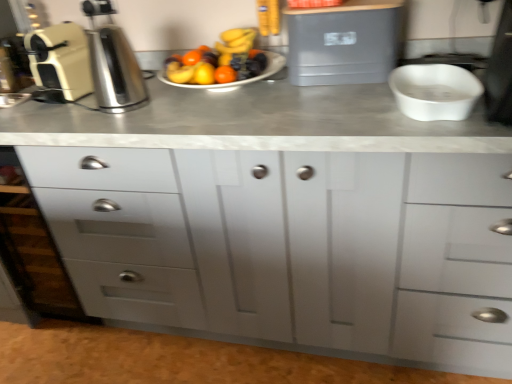
Where is `white matte chest of drawers at center`? white matte chest of drawers at center is located at coordinates (x=292, y=246).

Describe the element at coordinates (292, 246) in the screenshot. I see `white matte chest of drawers at center` at that location.

At what (x,y) coordinates should I click in order to perform the action: click on cream matte coffee machine at left, the 2th appliance in the right-to-left sequence. Please return your answer as a coordinate pair (x, y). Image resolution: width=512 pixels, height=384 pixels. Looking at the image, I should click on (59, 63).

The height and width of the screenshot is (384, 512). What do you see at coordinates (59, 63) in the screenshot?
I see `cream matte coffee machine at left, the 2th appliance in the right-to-left sequence` at bounding box center [59, 63].

This screenshot has height=384, width=512. In order to click on white glossy mixing bowl at right in this screenshot , I will do `click(435, 91)`.

Does point (372, 77) lie in front of point (102, 80)?

No, (372, 77) is further to viewer.

Choose the correct answer: Is gray plastic container at upper center, the second appliance in the left-to-right sequence, inside satin silver coffee machine at left or outside it?

gray plastic container at upper center, the second appliance in the left-to-right sequence, is outside satin silver coffee machine at left.

Is gray plastic container at upper center, the 1th appliance positioned from the right, to the right of satin silver coffee machine at left from the viewer's perspective?

Yes, gray plastic container at upper center, the 1th appliance positioned from the right, is to the right of satin silver coffee machine at left.

From the image's perspective, is gray plastic container at upper center, the 1th appliance positioned from the right, located above satin silver coffee machine at left?

Yes, from the image's perspective, gray plastic container at upper center, the 1th appliance positioned from the right, is on top of satin silver coffee machine at left.

Which of these two, white matte drawer at left or gray plastic container at upper center, the 1th appliance positioned from the right, stands shorter?

gray plastic container at upper center, the 1th appliance positioned from the right, is shorter.

This screenshot has width=512, height=384. Identify the location of the 2nd appliance in front when counting from the white matte drawer at left. (345, 42).

Based on the photo, from the image's perspective, is white matte drawer at left above or below gray plastic container at upper center, the 1th appliance positioned from the right?

From the image's perspective, white matte drawer at left appears below gray plastic container at upper center, the 1th appliance positioned from the right.

Considering their positions, is white matte drawer at left located in front of or behind gray plastic container at upper center, the 1th appliance positioned from the right?

white matte drawer at left is positioned farther from the viewer than gray plastic container at upper center, the 1th appliance positioned from the right.

Is cream matte coffee machine at left, marked as the 1th appliance in a left-to-right arrangement, next to gray plastic container at upper center, the second appliance in the left-to-right sequence, and touching it?

No, cream matte coffee machine at left, marked as the 1th appliance in a left-to-right arrangement, is not next to gray plastic container at upper center, the second appliance in the left-to-right sequence.

Is cream matte coffee machine at left, the 2th appliance in the right-to-left sequence, bigger than gray plastic container at upper center, the second appliance in the left-to-right sequence?

Actually, cream matte coffee machine at left, the 2th appliance in the right-to-left sequence, might be smaller than gray plastic container at upper center, the second appliance in the left-to-right sequence.

Considering the sizes of objects cream matte coffee machine at left, the 2th appliance in the right-to-left sequence, and gray plastic container at upper center, the second appliance in the left-to-right sequence, in the image provided, who is wider, cream matte coffee machine at left, the 2th appliance in the right-to-left sequence, or gray plastic container at upper center, the second appliance in the left-to-right sequence,?

Wider between the two is cream matte coffee machine at left, the 2th appliance in the right-to-left sequence.

Consider the image. From a real-world perspective, between cream matte coffee machine at left, marked as the 1th appliance in a left-to-right arrangement, and gray plastic container at upper center, the second appliance in the left-to-right sequence, who is vertically lower?

gray plastic container at upper center, the second appliance in the left-to-right sequence, is physically lower.

Is point (402, 342) farther from camera compared to point (86, 264)?

No.

Is white matte chest of drawers at center turned away from white matte drawer at left?

That's not correct — white matte chest of drawers at center is not looking away from white matte drawer at left.

Between white matte chest of drawers at center and white matte drawer at left, which one has larger size?

white matte chest of drawers at center is bigger.

Is white matte chest of drawers at center further to camera compared to white matte drawer at left?

No, the depth of white matte chest of drawers at center is less than that of white matte drawer at left.

Looking at this image, does white matte chest of drawers at center have a larger size compared to gray plastic container at upper center, the second appliance in the left-to-right sequence?

Indeed, white matte chest of drawers at center has a larger size compared to gray plastic container at upper center, the second appliance in the left-to-right sequence.

Is white matte chest of drawers at center next to gray plastic container at upper center, the second appliance in the left-to-right sequence, and touching it?

No.

Who is shorter, white matte chest of drawers at center or gray plastic container at upper center, the second appliance in the left-to-right sequence?

With less height is gray plastic container at upper center, the second appliance in the left-to-right sequence.

Is white matte chest of drawers at center at the left side of gray plastic container at upper center, the second appliance in the left-to-right sequence?

Indeed, white matte chest of drawers at center is positioned on the left side of gray plastic container at upper center, the second appliance in the left-to-right sequence.

How many degrees apart are the facing directions of satin silver coffee machine at left and white matte drawer at left?

46 degrees separate the facing orientations of satin silver coffee machine at left and white matte drawer at left.

Considering the sizes of satin silver coffee machine at left and white matte drawer at left in the image, is satin silver coffee machine at left taller or shorter than white matte drawer at left?

satin silver coffee machine at left is shorter than white matte drawer at left.

Where is `drawer on the left of the satin silver coffee machine at left`? drawer on the left of the satin silver coffee machine at left is located at coordinates (119, 231).

Is satin silver coffee machine at left at the left side of white matte drawer at left?

No.

Which is behind, white glossy mixing bowl at right or gray plastic container at upper center, the second appliance in the left-to-right sequence?

gray plastic container at upper center, the second appliance in the left-to-right sequence, is more distant.

Considering the positions of objects white glossy mixing bowl at right and gray plastic container at upper center, the second appliance in the left-to-right sequence, in the image provided, who is more to the right, white glossy mixing bowl at right or gray plastic container at upper center, the second appliance in the left-to-right sequence,?

Positioned to the right is white glossy mixing bowl at right.

Which point is more distant from viewer, (425, 116) or (317, 43)?

The point (317, 43) is behind.

Choose the correct answer: Is white glossy mixing bowl at right inside gray plastic container at upper center, the second appliance in the left-to-right sequence, or outside it?

white glossy mixing bowl at right exists outside the volume of gray plastic container at upper center, the second appliance in the left-to-right sequence.

At what (x,y) coordinates should I click in order to perform the action: click on appliance beneath the satin silver coffee machine at left (from a real-world perspective). Please return your answer as a coordinate pair (x, y). The image size is (512, 384). Looking at the image, I should click on (345, 42).

Where is `drawer on the left of the gray plastic container at upper center, the 1th appliance positioned from the right`? The image size is (512, 384). drawer on the left of the gray plastic container at upper center, the 1th appliance positioned from the right is located at coordinates (119, 231).

When comparing their distances from satin silver coffee machine at left, does gray plastic container at upper center, the second appliance in the left-to-right sequence, or white glossy mixing bowl at right seem closer?

gray plastic container at upper center, the second appliance in the left-to-right sequence, lies closer to satin silver coffee machine at left than the other object.

From the picture: Based on their spatial positions, is gray plastic container at upper center, the 1th appliance positioned from the right, or white glossy mixing bowl at right further from white matte drawer at left?

The object further to white matte drawer at left is white glossy mixing bowl at right.

Considering their positions, is gray plastic container at upper center, the second appliance in the left-to-right sequence, positioned further to white glossy mixing bowl at right than white matte drawer at left?

Among the two, white matte drawer at left is located further to white glossy mixing bowl at right.

Looking at this image, considering their positions, is white matte drawer at left positioned closer to white matte chest of drawers at center than gray plastic container at upper center, the second appliance in the left-to-right sequence?

The object closer to white matte chest of drawers at center is white matte drawer at left.

Considering their positions, is cream matte coffee machine at left, marked as the 1th appliance in a left-to-right arrangement, positioned closer to white matte drawer at left than satin silver coffee machine at left?

The object closer to white matte drawer at left is satin silver coffee machine at left.

Estimate the real-world distances between objects in this image. Which object is further from cream matte coffee machine at left, the 2th appliance in the right-to-left sequence, white matte chest of drawers at center or white matte drawer at left?

white matte chest of drawers at center.

From the image, which object appears to be farther from gray plastic container at upper center, the second appliance in the left-to-right sequence, cream matte coffee machine at left, marked as the 1th appliance in a left-to-right arrangement, or white glossy mixing bowl at right?

The object further to gray plastic container at upper center, the second appliance in the left-to-right sequence, is cream matte coffee machine at left, marked as the 1th appliance in a left-to-right arrangement.

When comparing their distances from white matte drawer at left, does cream matte coffee machine at left, marked as the 1th appliance in a left-to-right arrangement, or white matte chest of drawers at center seem closer?

The object closer to white matte drawer at left is white matte chest of drawers at center.

At what (x,y) coordinates should I click in order to perform the action: click on coffee machine between cream matte coffee machine at left, marked as the 1th appliance in a left-to-right arrangement, and gray plastic container at upper center, the second appliance in the left-to-right sequence, in the horizontal direction. Please return your answer as a coordinate pair (x, y). The image size is (512, 384). Looking at the image, I should click on (113, 63).

Image resolution: width=512 pixels, height=384 pixels. Identify the location of coffee machine situated between cream matte coffee machine at left, marked as the 1th appliance in a left-to-right arrangement, and white glossy mixing bowl at right from left to right. (113, 63).

At what (x,y) coordinates should I click in order to perform the action: click on appliance between cream matte coffee machine at left, marked as the 1th appliance in a left-to-right arrangement, and white glossy mixing bowl at right. Please return your answer as a coordinate pair (x, y). The image size is (512, 384). Looking at the image, I should click on pos(345,42).

Locate an element on the screen. This screenshot has height=384, width=512. appliance between white matte drawer at left and white matte chest of drawers at center from left to right is located at coordinates (59, 63).